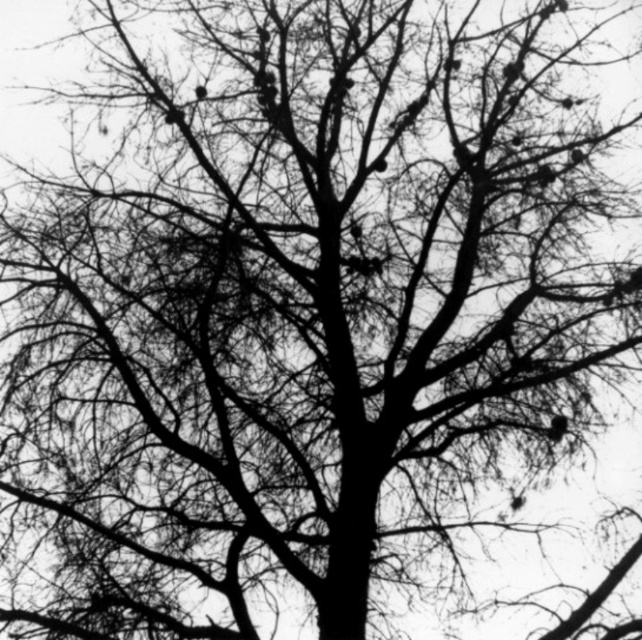
You are an ornithologist observing the two birds in the image. Which bird is closer to you, the silky black bird at upper right or the dark brown feathered bird at upper center?

The silky black bird at upper right is closer to you because it is positioned in front of the dark brown feathered bird at upper center.

In the scene shown: You are a photographer aiming to capture the silky black bird at upper right in the center of your photo. Given the bird is at coordinate point 0.669, 0.868, what adjustment should you make to your camera to center the bird?

To center the silky black bird at upper right, adjust the camera so the bird moves downward and to the left since its current position at point [557,428] places it in the upper right quadrant. The center of the image is at [321,320], so moving left decreases the x coordinate and moving down decreases the y coordinate.

In the black and white tree silhouette, there are two birds perched. The first is a silky black bird at upper right and the second is a dark brown feathered bird at upper center. Which bird is positioned more to the right side of the image?

The silky black bird at upper right is positioned more to the right side of the image than the dark brown feathered bird at upper center.